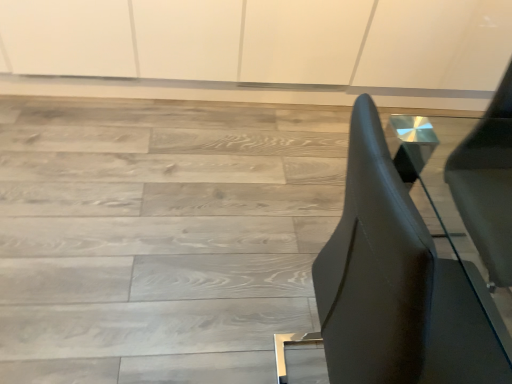
Question: Would you say metallic silver side table at center is inside or outside matte wood floor at center?

Choices:
 (A) outside
 (B) inside

Answer: (A)

Question: Looking at their shapes, would you say metallic silver side table at center is wider or thinner than matte wood floor at center?

Choices:
 (A) thin
 (B) wide

Answer: (A)

Question: From the image's perspective, relative to matte wood floor at center, is metallic silver side table at center above or below?

Choices:
 (A) above
 (B) below

Answer: (B)

Question: Looking at their shapes, would you say matte wood floor at center is wider or thinner than metallic silver side table at center?

Choices:
 (A) thin
 (B) wide

Answer: (B)

Question: In terms of size, does matte wood floor at center appear bigger or smaller than metallic silver side table at center?

Choices:
 (A) big
 (B) small

Answer: (A)

Question: Choose the correct answer: Is matte wood floor at center inside metallic silver side table at center or outside it?

Choices:
 (A) inside
 (B) outside

Answer: (B)

Question: Visually, is matte wood floor at center positioned to the left or to the right of metallic silver side table at center?

Choices:
 (A) left
 (B) right

Answer: (A)